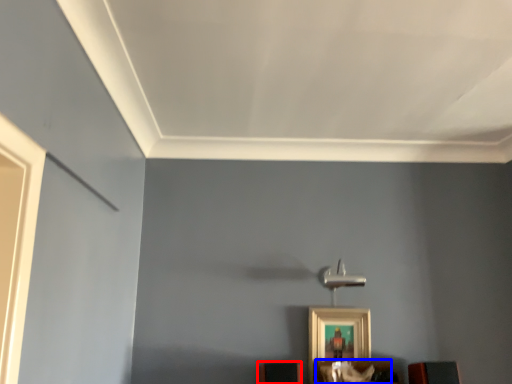
Question: Which point is further to the camera, furniture (highlighted by a red box) or furniture (highlighted by a blue box)?

Choices:
 (A) furniture
 (B) furniture

Answer: (A)